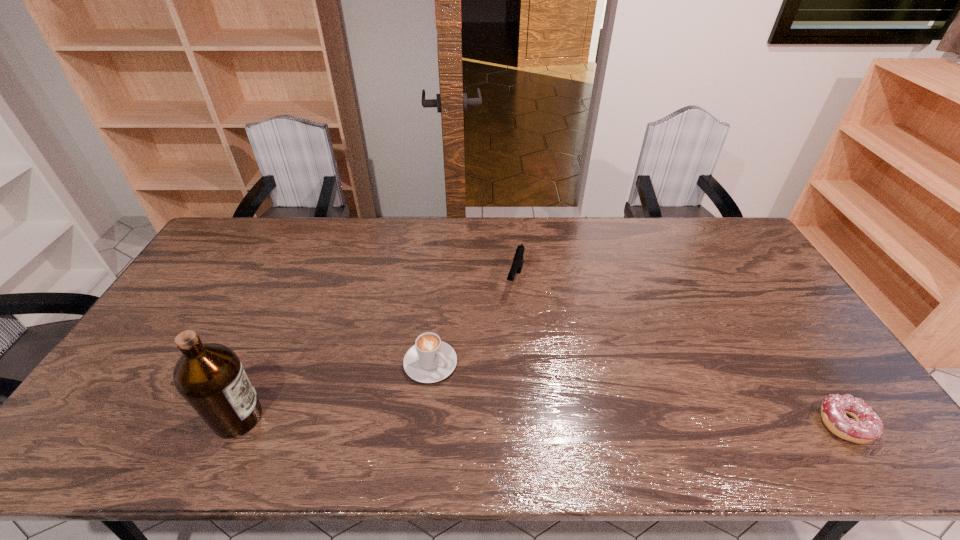
This screenshot has width=960, height=540. In order to click on the tallest object in this screenshot , I will do `click(209, 376)`.

The width and height of the screenshot is (960, 540). Identify the location of the leftmost object. (209, 376).

This screenshot has height=540, width=960. I want to click on the shortest object, so click(865, 426).

The image size is (960, 540). Find the location of `the rightmost object`. the rightmost object is located at coordinates (865, 426).

At what (x,y) coordinates should I click in order to perform the action: click on the second farthest object. Please return your answer as a coordinate pair (x, y). Image resolution: width=960 pixels, height=540 pixels. Looking at the image, I should click on (430, 360).

Where is `the third object from right to left`? The image size is (960, 540). the third object from right to left is located at coordinates (430, 360).

Where is `pistol`? pistol is located at coordinates point(518,260).

Image resolution: width=960 pixels, height=540 pixels. Find the location of `the farthest object`. the farthest object is located at coordinates (518, 260).

Identify the location of free space located 0.080m on the label of the tallest object. (297, 417).

What are the coordinates of `vacant area situated 0.150m on the back of the doughnut` in the screenshot? It's located at (799, 354).